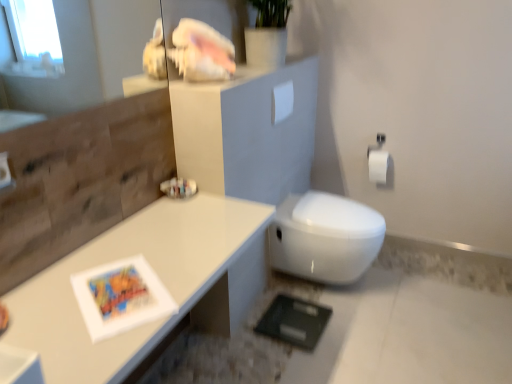
Locate an element on the screen. Image resolution: width=512 pixels, height=384 pixels. white glossy table at upper left is located at coordinates (125, 257).

In order to face white matte toilet paper at right, which is counted as the second toilet paper, starting from the top, should I rotate leftwards or rightwards?

Rotate your view right by about 16.468°.

What do you see at coordinates (141, 85) in the screenshot? I see `white glossy shell at upper center` at bounding box center [141, 85].

Find the location of a particular element. white glossy table at upper left is located at coordinates click(125, 257).

Is white glossy bidet at center far from white matte toilet paper at right, the second toilet paper in the left-to-right sequence?

Actually, white glossy bidet at center and white matte toilet paper at right, the second toilet paper in the left-to-right sequence, are a little close together.

Is the position of white glossy bidet at center less distant than that of white matte toilet paper at right, the second toilet paper in the front-to-back sequence?

Yes, white glossy bidet at center is closer to the camera.

Is white glossy bidet at center facing towards white matte toilet paper at right, the second toilet paper in the left-to-right sequence?

No, white glossy bidet at center does not turn towards white matte toilet paper at right, the second toilet paper in the left-to-right sequence.

How far apart are white glossy bidet at center and white matte toilet paper at right, which is counted as the second toilet paper, starting from the top?

A distance of 60.60 centimeters exists between white glossy bidet at center and white matte toilet paper at right, which is counted as the second toilet paper, starting from the top.

How much distance is there between white matte toilet paper at right, the second toilet paper in the front-to-back sequence, and white matte toilet paper at upper center, the 1th toilet paper in the top-to-bottom sequence?

white matte toilet paper at right, the second toilet paper in the front-to-back sequence, is 72.01 centimeters away from white matte toilet paper at upper center, the 1th toilet paper in the top-to-bottom sequence.

From the picture: Which of these two, white matte toilet paper at right, which is counted as the second toilet paper, starting from the top, or white matte toilet paper at upper center, which appears as the second toilet paper when ordered from the bottom, stands shorter?

white matte toilet paper at upper center, which appears as the second toilet paper when ordered from the bottom.

The width and height of the screenshot is (512, 384). In order to click on toilet paper above the white matte toilet paper at right, the first toilet paper when ordered from bottom to top (from the image's perspective) in this screenshot , I will do `click(282, 102)`.

Which is less distant, (387, 161) or (291, 107)?

The point (291, 107) is closer to the camera.

From the image's perspective, is white glossy bidet at center located above or below white matte toilet paper at upper center, which appears as the second toilet paper when ordered from the bottom?

Clearly, from the image's perspective, white glossy bidet at center is below white matte toilet paper at upper center, which appears as the second toilet paper when ordered from the bottom.

Is white glossy bidet at center at the right side of white matte toilet paper at upper center, the 1th toilet paper when ordered from front to back?

Correct, you'll find white glossy bidet at center to the right of white matte toilet paper at upper center, the 1th toilet paper when ordered from front to back.

Looking at this image, considering their positions, is white glossy bidet at center located in front of or behind white matte toilet paper at upper center, the 1th toilet paper in the top-to-bottom sequence?

white glossy bidet at center is positioned closer to the viewer than white matte toilet paper at upper center, the 1th toilet paper in the top-to-bottom sequence.

From a real-world perspective, is white glossy bidet at center under white matte toilet paper at upper center, the 1th toilet paper in the top-to-bottom sequence?

Correct, in the physical world, white glossy bidet at center is lower than white matte toilet paper at upper center, the 1th toilet paper in the top-to-bottom sequence.

Between white glossy shell at upper center and white matte toilet paper at right, which is the 1th toilet paper in right-to-left order, which one has more height?

A: white matte toilet paper at right, which is the 1th toilet paper in right-to-left order.

I want to click on the 2nd toilet paper counting from the right side of the white glossy shell at upper center, so click(378, 166).

Is white glossy shell at upper center turned away from white matte toilet paper at right, the first toilet paper when ordered from bottom to top?

white glossy shell at upper center is not turned away from white matte toilet paper at right, the first toilet paper when ordered from bottom to top.

From the image's perspective, is white glossy shell at upper center positioned above or below white matte toilet paper at right, arranged as the 1th toilet paper when viewed from the back?

white glossy shell at upper center is situated higher than white matte toilet paper at right, arranged as the 1th toilet paper when viewed from the back, in the image.

The image size is (512, 384). I want to click on table that appears below the white matte toilet paper at upper center, which is the 2th toilet paper in back-to-front order (from a real-world perspective), so click(x=125, y=257).

From the picture: Is white matte toilet paper at upper center, which is the 2th toilet paper in back-to-front order, spatially inside white glossy table at upper left, or outside of it?

white matte toilet paper at upper center, which is the 2th toilet paper in back-to-front order, is not inside white glossy table at upper left, it's outside.

What's the angular difference between white matte toilet paper at upper center, which appears as the second toilet paper when ordered from the bottom, and white glossy table at upper left's facing directions?

The angle between the facing direction of white matte toilet paper at upper center, which appears as the second toilet paper when ordered from the bottom, and the facing direction of white glossy table at upper left is 0.607 degrees.

Does white matte toilet paper at upper center, the second toilet paper viewed from the right, appear on the right side of white glossy table at upper left?

Indeed, white matte toilet paper at upper center, the second toilet paper viewed from the right, is positioned on the right side of white glossy table at upper left.

Is white glossy shell at upper center a part of white glossy bidet at center?

No, white glossy shell at upper center is not a part of white glossy bidet at center.

Locate an element on the screen. The height and width of the screenshot is (384, 512). ledge on the left side of white glossy bidet at center is located at coordinates (141, 85).

Considering the sizes of objects white glossy bidet at center and white glossy shell at upper center in the image provided, who is taller, white glossy bidet at center or white glossy shell at upper center?

white glossy bidet at center.

Measure the distance between white glossy bidet at center and white glossy shell at upper center.

white glossy bidet at center and white glossy shell at upper center are 34.84 inches apart from each other.

Which is in front, point (138, 342) or point (272, 230)?

Positioned in front is point (138, 342).

Can you confirm if white glossy table at upper left is smaller than white glossy bidet at center?

No, white glossy table at upper left is not smaller than white glossy bidet at center.

From the image's perspective, which object appears higher, white glossy table at upper left or white glossy bidet at center?

white glossy bidet at center, from the image's perspective.

Considering the relative positions of white glossy table at upper left and white glossy bidet at center in the image provided, is white glossy table at upper left to the left of white glossy bidet at center from the viewer's perspective?

Yes.

Where is `bidet that appears below the white matte toilet paper at right, the first toilet paper when ordered from bottom to top (from the image's perspective)`? The image size is (512, 384). bidet that appears below the white matte toilet paper at right, the first toilet paper when ordered from bottom to top (from the image's perspective) is located at coordinates (325, 237).

What are the coordinates of `toilet paper above the white matte toilet paper at right, the second toilet paper in the front-to-back sequence (from the image's perspective)` in the screenshot? It's located at (282, 102).

Based on their spatial positions, is white glossy table at upper left or white matte toilet paper at right, the first toilet paper when ordered from bottom to top, closer to white glossy shell at upper center?

The object closer to white glossy shell at upper center is white glossy table at upper left.

Looking at the image, which one is located closer to white matte toilet paper at upper center, which is the 2th toilet paper in back-to-front order, white glossy table at upper left or white glossy shell at upper center?

Based on the image, white glossy shell at upper center appears to be nearer to white matte toilet paper at upper center, which is the 2th toilet paper in back-to-front order.

When comparing their distances from white matte toilet paper at right, the second toilet paper in the left-to-right sequence, does white glossy table at upper left or white glossy shell at upper center seem closer?

The object closer to white matte toilet paper at right, the second toilet paper in the left-to-right sequence, is white glossy shell at upper center.

When comparing their distances from white matte toilet paper at right, the first toilet paper when ordered from bottom to top, does white glossy shell at upper center or white glossy bidet at center seem closer?

white glossy bidet at center is positioned closer to the anchor white matte toilet paper at right, the first toilet paper when ordered from bottom to top.

Estimate the real-world distances between objects in this image. Which object is closer to white matte toilet paper at right, the second toilet paper in the front-to-back sequence, white glossy shell at upper center or white glossy table at upper left?

white glossy shell at upper center is positioned closer to the anchor white matte toilet paper at right, the second toilet paper in the front-to-back sequence.

Looking at this image, estimate the real-world distances between objects in this image. Which object is closer to white glossy bidet at center, white glossy table at upper left or white matte toilet paper at upper center, the 1th toilet paper when ordered from front to back?

white matte toilet paper at upper center, the 1th toilet paper when ordered from front to back, is closer to white glossy bidet at center.

Based on their spatial positions, is white glossy table at upper left or white matte toilet paper at upper center, the first toilet paper viewed from the left, further from white matte toilet paper at right, which is counted as the second toilet paper, starting from the top?

Among the two, white glossy table at upper left is located further to white matte toilet paper at right, which is counted as the second toilet paper, starting from the top.

Considering their positions, is white glossy shell at upper center positioned closer to white matte toilet paper at upper center, the first toilet paper viewed from the left, than white glossy bidet at center?

Among the two, white glossy shell at upper center is located nearer to white matte toilet paper at upper center, the first toilet paper viewed from the left.

Find the location of `ledge positioned between white glossy table at upper left and white matte toilet paper at upper center, the 1th toilet paper in the top-to-bottom sequence, from near to far`. ledge positioned between white glossy table at upper left and white matte toilet paper at upper center, the 1th toilet paper in the top-to-bottom sequence, from near to far is located at coordinates (141, 85).

Image resolution: width=512 pixels, height=384 pixels. What are the coordinates of `ledge between white glossy table at upper left and white matte toilet paper at right, which is counted as the second toilet paper, starting from the top, from front to back` in the screenshot? It's located at (141, 85).

The width and height of the screenshot is (512, 384). Identify the location of bidet located between white glossy table at upper left and white matte toilet paper at right, the second toilet paper in the left-to-right sequence, in the depth direction. (325, 237).

This screenshot has width=512, height=384. I want to click on bidet between white glossy shell at upper center and white glossy table at upper left from top to bottom, so (325, 237).